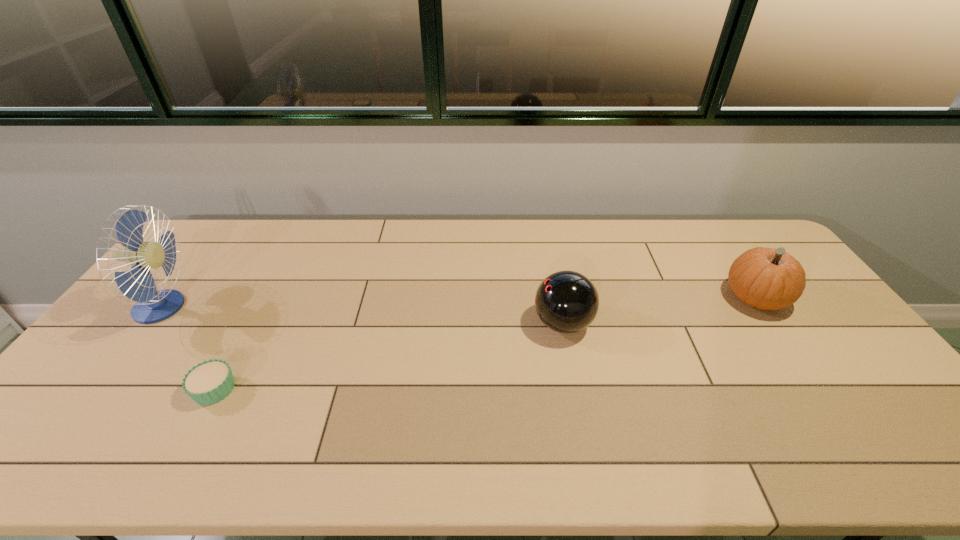
In order to click on fan in this screenshot , I will do `click(151, 306)`.

What are the coordinates of `the leftmost object` in the screenshot? It's located at (151, 306).

Find the location of a particular element. the rightmost object is located at coordinates (764, 278).

Where is `pumpkin`? This screenshot has height=540, width=960. pumpkin is located at coordinates [x=764, y=278].

Where is `the third object from left to right`? This screenshot has width=960, height=540. the third object from left to right is located at coordinates (566, 301).

At what (x,y) coordinates should I click in order to perform the action: click on bowling ball. Please return your answer as a coordinate pair (x, y). Looking at the image, I should click on (566, 301).

You are a GUI agent. You are given a task and a screenshot of the screen. Output one action in this format:
    pyautogui.click(x=<x>, y=<y>)
    Task: Click on the nearest object
    
    Given the screenshot: What is the action you would take?
    pyautogui.click(x=209, y=382)

Identify the location of the third object from right to left. The height and width of the screenshot is (540, 960). (209, 382).

Locate an element on the screen. The width and height of the screenshot is (960, 540). vacant region located 0.330m at the front of the fan where the blades are visible is located at coordinates (298, 307).

In order to click on free space located 0.050m on the stem of the rightmost object in this screenshot , I will do [707, 298].